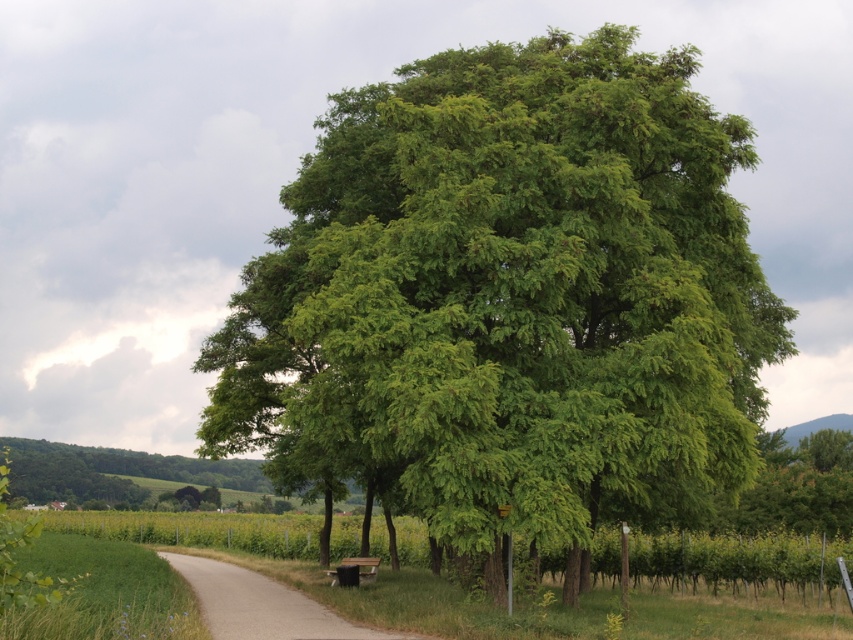
You are a hiker who wants to rest on the wooden park bench at lower center. You are currently standing next to the green leafy tree at center. Which direction should you walk to reach the bench?

The wooden park bench at lower center is behind the green leafy tree at center, so you should walk forward away from the green leafy tree at center to reach it.

You are standing on the gray concrete path at center and want to walk towards the green leafy tree at center. Is the tree in front of or behind the path?

The green leafy tree at center is closer to the viewer than the gray concrete path at center, so the tree is in front of the path.

You are a gardener who needs to water both the green leafy tree at center and the wooden park bench at lower center. You have a hose that can reach up to 7 meters. Starting from the bench, can you water the tree without moving the hose nozzle?

The green leafy tree at center and wooden park bench at lower center are 7.55 meters apart. Since the hose can only reach up to 7 meters, the gardener cannot water the tree from the bench without moving the hose nozzle because the distance exceeds the hose reach.